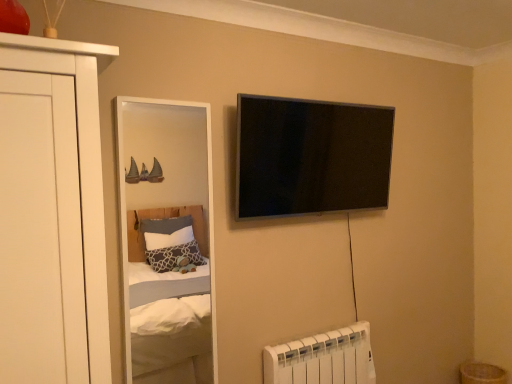
You are a GUI agent. You are given a task and a screenshot of the screen. Output one action in this format:
    pyautogui.click(x=<x>, y=<y>)
    Task: Click on the white plastic radiator at lower right
    
    Given the screenshot: What is the action you would take?
    pyautogui.click(x=323, y=358)

Measure the distance between point (301, 376) and camera.

Point (301, 376) and camera are 7.16 feet apart from each other.

What do you see at coordinates (323, 358) in the screenshot?
I see `white plastic radiator at lower right` at bounding box center [323, 358].

Locate an element on the screen. This screenshot has width=512, height=384. white plastic radiator at lower right is located at coordinates (323, 358).